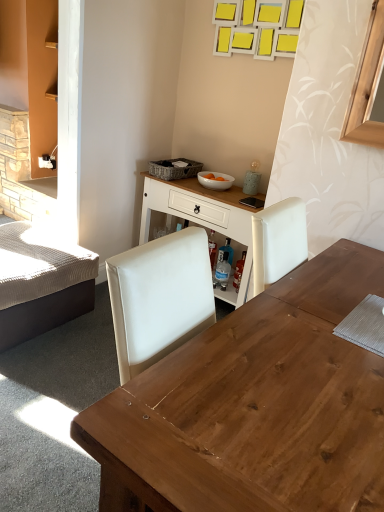
What do you see at coordinates (215, 180) in the screenshot?
I see `white glossy bowl at center` at bounding box center [215, 180].

Find the location of `white glossy bowl at center`. white glossy bowl at center is located at coordinates (215, 180).

What do you see at coordinates (203, 218) in the screenshot?
I see `white wood table at center` at bounding box center [203, 218].

In order to face woven gray picnic basket at upper center, should I rotate leftwards or rightwards?

Rotate your view left by about 1.999°.

From the picture: What is the approximate width of wooden desk at center?

It is 1.42 meters.

Where is `white glossy bowl at center`? This screenshot has width=384, height=512. white glossy bowl at center is located at coordinates (215, 180).

From a real-world perspective, is white glossy bowl at center beneath wooden desk at center?

No, from a real-world perspective, white glossy bowl at center is not below wooden desk at center.

Identify the location of bowl above the wooden desk at center (from a real-world perspective). (215, 180).

Considering the sizes of white glossy bowl at center and wooden desk at center in the image, is white glossy bowl at center bigger or smaller than wooden desk at center?

white glossy bowl at center is smaller than wooden desk at center.

Considering their positions, is white glossy bowl at center located in front of or behind wooden desk at center?

In the image, white glossy bowl at center appears behind wooden desk at center.

From the picture: Are wooden desk at center and textured beige bed at left far apart?

Indeed, wooden desk at center is not near textured beige bed at left.

Based on their sizes in the image, would you say wooden desk at center is bigger or smaller than textured beige bed at left?

Clearly, wooden desk at center is larger in size than textured beige bed at left.

Is wooden desk at center aimed at textured beige bed at left?

No, wooden desk at center is not oriented towards textured beige bed at left.

Locate an element on the screen. The height and width of the screenshot is (512, 384). desk on the right side of textured beige bed at left is located at coordinates (254, 406).

Considering the relative sizes of white glossy bowl at center and woven gray picnic basket at upper center in the image provided, is white glossy bowl at center thinner than woven gray picnic basket at upper center?

Correct, the width of white glossy bowl at center is less than that of woven gray picnic basket at upper center.

Consider the image. Between white glossy bowl at center and woven gray picnic basket at upper center, which one has less height?

white glossy bowl at center is shorter.

Between white glossy bowl at center and woven gray picnic basket at upper center, which one appears on the right side from the viewer's perspective?

From the viewer's perspective, white glossy bowl at center appears more on the right side.

How far apart are white glossy bowl at center and woven gray picnic basket at upper center?

white glossy bowl at center and woven gray picnic basket at upper center are 18.69 centimeters apart from each other.

Between textured beige bed at left and white wood table at center, which one appears on the right side from the viewer's perspective?

white wood table at center.

From a real-world perspective, who is located higher, textured beige bed at left or white wood table at center?

white wood table at center is physically above.

You are a GUI agent. You are given a task and a screenshot of the screen. Output one action in this format:
    pyautogui.click(x=<x>, y=<y>)
    Task: Click on the bed beneath the white wood table at center (from a real-world perspective)
    This screenshot has width=384, height=512.
    Given the screenshot: What is the action you would take?
    pyautogui.click(x=41, y=281)

Considering the sizes of textured beige bed at left and white wood table at center in the image, is textured beige bed at left taller or shorter than white wood table at center?

textured beige bed at left is shorter than white wood table at center.

Between point (214, 186) and point (8, 327), which one is positioned behind?

The point (214, 186) is behind.

Considering the relative positions of white glossy bowl at center and textured beige bed at left in the image provided, is white glossy bowl at center to the right of textured beige bed at left from the viewer's perspective?

Correct, you'll find white glossy bowl at center to the right of textured beige bed at left.

Is white glossy bowl at center taller than textured beige bed at left?

No, white glossy bowl at center is not taller than textured beige bed at left.

Which object is closer to the camera, white wood table at center or white glossy bowl at center?

Positioned in front is white wood table at center.

Does white wood table at center have a smaller size compared to white glossy bowl at center?

No, white wood table at center is not smaller than white glossy bowl at center.

Is white wood table at center inside or outside of white glossy bowl at center?

white wood table at center cannot be found inside white glossy bowl at center.

Is point (188, 210) positioned behind point (214, 186)?

Yes, it is behind point (214, 186).

Does point (179, 172) come behind point (251, 349)?

Yes.

I want to click on desk that appears in front of the woven gray picnic basket at upper center, so click(254, 406).

Which of these two, woven gray picnic basket at upper center or wooden desk at center, stands taller?

Standing taller between the two is wooden desk at center.

In the image, there is a wooden desk at center. At what (x,y) coordinates should I click in order to perform the action: click on bowl above it (from the image's perspective). Please return your answer as a coordinate pair (x, y). This screenshot has width=384, height=512. Looking at the image, I should click on (215, 180).

Where is `bed lying on the left of wooden desk at center`? The height and width of the screenshot is (512, 384). bed lying on the left of wooden desk at center is located at coordinates (41, 281).

Estimate the real-world distances between objects in this image. Which object is further from white glossy bowl at center, woven gray picnic basket at upper center or white wood table at center?

white wood table at center is positioned further to the anchor white glossy bowl at center.

From the image, which object appears to be nearer to textured beige bed at left, white glossy bowl at center or woven gray picnic basket at upper center?

The object closer to textured beige bed at left is woven gray picnic basket at upper center.

Based on their spatial positions, is woven gray picnic basket at upper center or wooden desk at center closer to white wood table at center?

The object closer to white wood table at center is woven gray picnic basket at upper center.

Estimate the real-world distances between objects in this image. Which object is closer to textured beige bed at left, woven gray picnic basket at upper center or wooden desk at center?

woven gray picnic basket at upper center lies closer to textured beige bed at left than the other object.

Looking at the image, which one is located further to woven gray picnic basket at upper center, textured beige bed at left or white glossy bowl at center?

textured beige bed at left is further to woven gray picnic basket at upper center.

From the image, which object appears to be farther from white wood table at center, wooden desk at center or white glossy bowl at center?

Based on the image, wooden desk at center appears to be further to white wood table at center.

Estimate the real-world distances between objects in this image. Which object is closer to white wood table at center, wooden desk at center or woven gray picnic basket at upper center?

woven gray picnic basket at upper center is closer to white wood table at center.

Estimate the real-world distances between objects in this image. Which object is further from white wood table at center, wooden desk at center or textured beige bed at left?

wooden desk at center is positioned further to the anchor white wood table at center.

You are a GUI agent. You are given a task and a screenshot of the screen. Output one action in this format:
    pyautogui.click(x=<x>, y=<y>)
    Task: Click on the table between textured beige bed at left and white glossy bowl at center in the horizontal direction
    This screenshot has width=384, height=512.
    Given the screenshot: What is the action you would take?
    pyautogui.click(x=203, y=218)

This screenshot has height=512, width=384. I want to click on bed between wooden desk at center and white glossy bowl at center in the front-back direction, so click(x=41, y=281).

The height and width of the screenshot is (512, 384). In order to click on table positioned between wooden desk at center and white glossy bowl at center from near to far in this screenshot , I will do `click(203, 218)`.

Identify the location of bowl located between wooden desk at center and woven gray picnic basket at upper center in the depth direction. This screenshot has height=512, width=384. (215, 180).